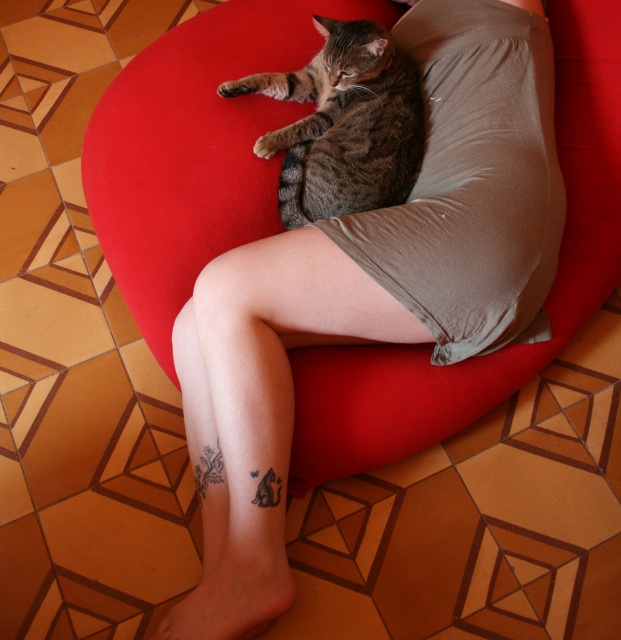
You are standing at the position of point (333, 132) and want to move to point (561, 32). Based on the scene description, will you have to walk forward or backward to reach your destination?

Since point (561, 32) is behind point (333, 132), you will have to walk backward to reach it.

You are a photographer setting up a shoot in this room. You need to position a light source in front of the velvet red bean bag chair at center to highlight it. Will the tabby fur cat at center block the light from reaching the chair?

The tabby fur cat at center is behind the velvet red bean bag chair at center, so it will not block the light source placed in front of the chair.